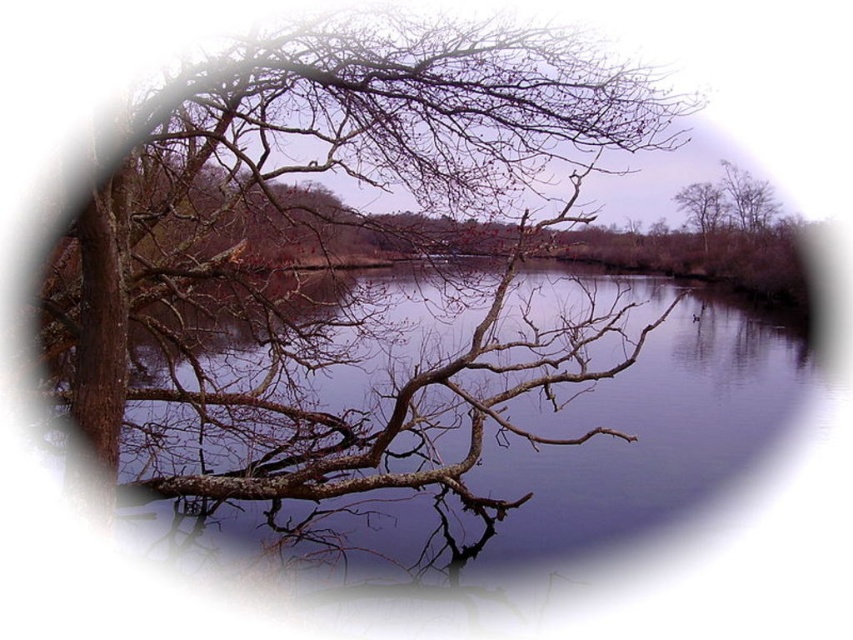
Can you confirm if smooth water at center is thinner than brown rough tree at upper right?

Incorrect, smooth water at center's width is not less than brown rough tree at upper right's.

Identify the location of smooth water at center. (561, 460).

Is smooth water at center positioned before brown rough tree at upper center?

Yes, smooth water at center is in front of brown rough tree at upper center.

Does point (408, 444) come farther from viewer compared to point (712, 221)?

No, it is not.

This screenshot has width=853, height=640. What are the coordinates of `smooth water at center` in the screenshot? It's located at (561, 460).

Which is in front, point (215, 182) or point (705, 227)?

Point (215, 182) is more forward.

Does brown rough bark tree at upper left appear on the right side of brown rough tree at upper center?

In fact, brown rough bark tree at upper left is to the left of brown rough tree at upper center.

Does point (332, 77) come in front of point (708, 228)?

Yes, point (332, 77) is in front of point (708, 228).

This screenshot has height=640, width=853. I want to click on brown rough bark tree at upper left, so click(x=323, y=244).